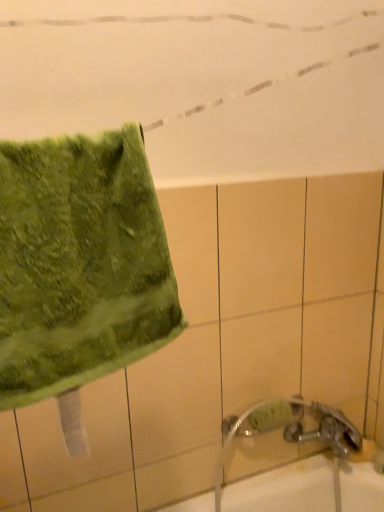
Question: Relative to green fuzzy towel at left, is silver metallic faucet at lower right in front or behind?

Choices:
 (A) front
 (B) behind

Answer: (B)

Question: From their relative heights in the image, would you say silver metallic faucet at lower right is taller or shorter than green fuzzy towel at left?

Choices:
 (A) short
 (B) tall

Answer: (B)

Question: In the image, is silver metallic faucet at lower right on the left side or the right side of green fuzzy towel at left?

Choices:
 (A) left
 (B) right

Answer: (B)

Question: Is green fuzzy towel at left taller or shorter than silver metallic faucet at lower right?

Choices:
 (A) tall
 (B) short

Answer: (B)

Question: From a real-world perspective, is green fuzzy towel at left above or below silver metallic faucet at lower right?

Choices:
 (A) above
 (B) below

Answer: (A)

Question: Considering their positions, is green fuzzy towel at left located in front of or behind silver metallic faucet at lower right?

Choices:
 (A) behind
 (B) front

Answer: (B)

Question: From the image's perspective, relative to silver metallic faucet at lower right, is green fuzzy towel at left above or below?

Choices:
 (A) above
 (B) below

Answer: (A)